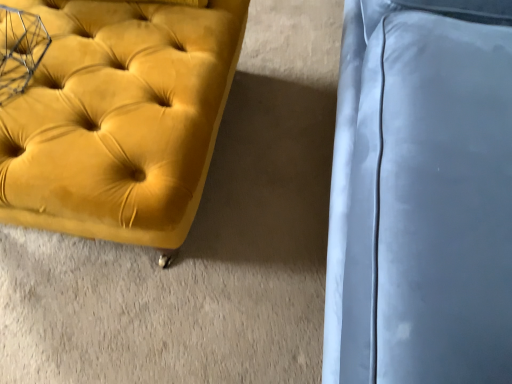
You are a GUI agent. You are given a task and a screenshot of the screen. Output one action in this format:
    pyautogui.click(x=<x>, y=<y>)
    Task: Click on the vacant space to the right of velvet yellow ottoman at left
    This screenshot has height=384, width=512.
    Given the screenshot: What is the action you would take?
    pyautogui.click(x=281, y=150)